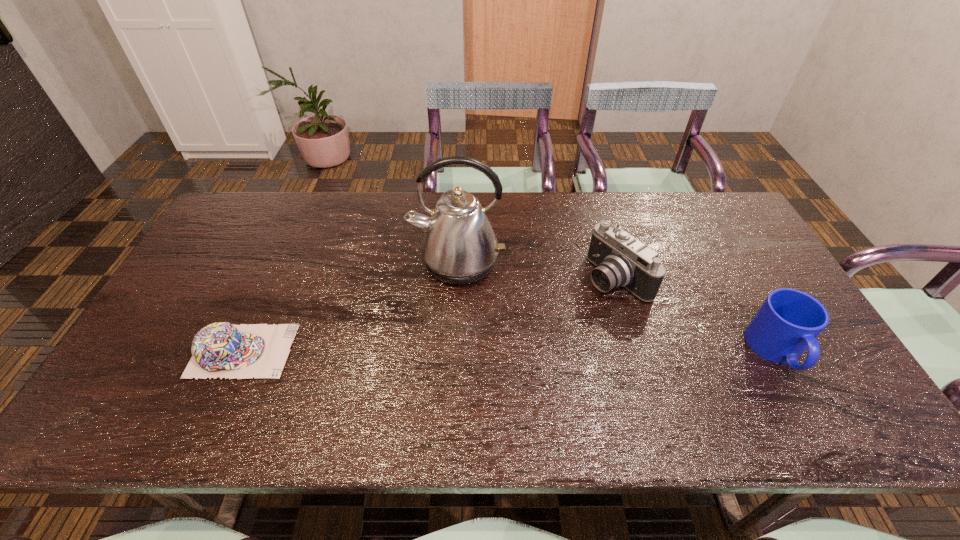
You are a GUI agent. You are given a task and a screenshot of the screen. Output one action in this format:
    pyautogui.click(x=<x>, y=<y>)
    Task: Click on the cap
    The height and width of the screenshot is (540, 960).
    Given the screenshot: What is the action you would take?
    pyautogui.click(x=221, y=349)

Locate an element on the screen. The width and height of the screenshot is (960, 540). the shortest object is located at coordinates (221, 349).

You are a GUI agent. You are given a task and a screenshot of the screen. Output one action in this format:
    pyautogui.click(x=<x>, y=<y>)
    Task: Click on the rightmost object
    The width and height of the screenshot is (960, 540).
    Given the screenshot: What is the action you would take?
    pyautogui.click(x=788, y=322)

You are a GUI agent. You are given a task and a screenshot of the screen. Output one action in this format:
    pyautogui.click(x=<x>, y=<y>)
    Task: Click on the camera
    The image size is (960, 540).
    Given the screenshot: What is the action you would take?
    pyautogui.click(x=621, y=260)

Where is `the third object from right to left`? The image size is (960, 540). the third object from right to left is located at coordinates (459, 247).

Locate an element on the screen. the tallest object is located at coordinates (459, 247).

Locate an element on the screen. The height and width of the screenshot is (540, 960). vacant space located 0.220m on the front, side, and top of the cap is located at coordinates (379, 351).

Image resolution: width=960 pixels, height=540 pixels. I want to click on vacant space located 0.240m on the front-facing side of the camera, so click(530, 334).

This screenshot has height=540, width=960. Find the location of `vacant space located 0.070m on the front-facing side of the camera`. vacant space located 0.070m on the front-facing side of the camera is located at coordinates (577, 304).

This screenshot has height=540, width=960. Identify the location of free space located on the front-facing side of the camera. (539, 328).